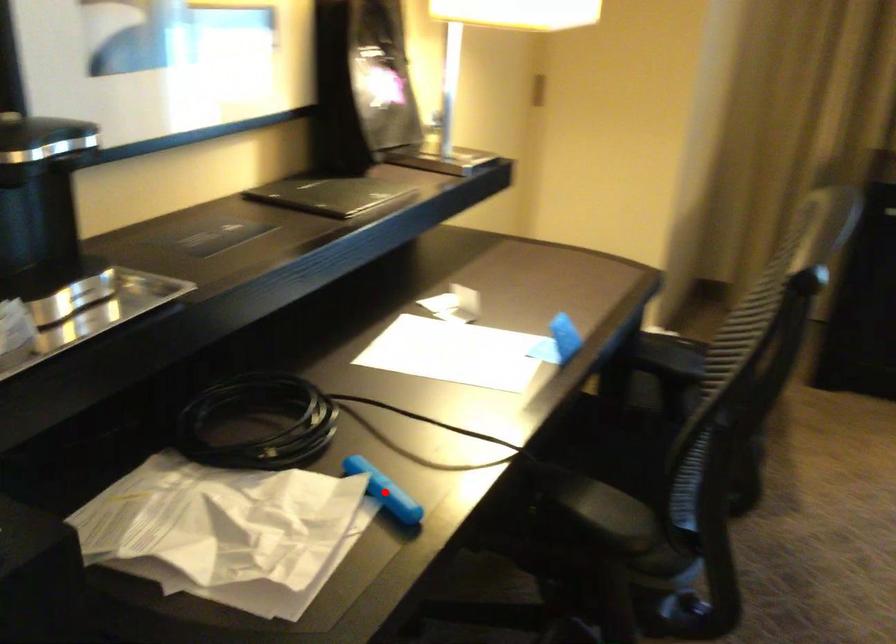
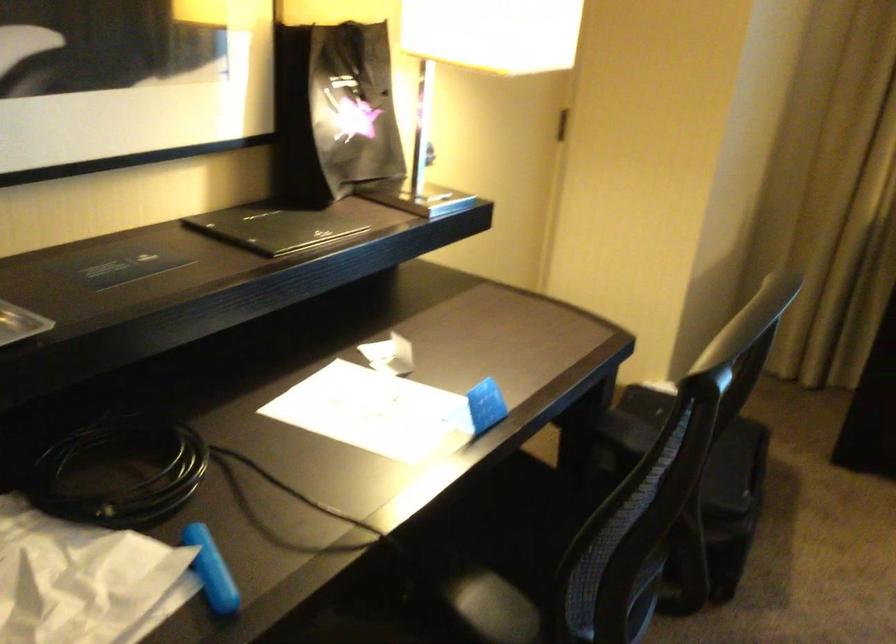
In the second image, find the point that corresponds to the highlighted location in the first image.

(211, 570)